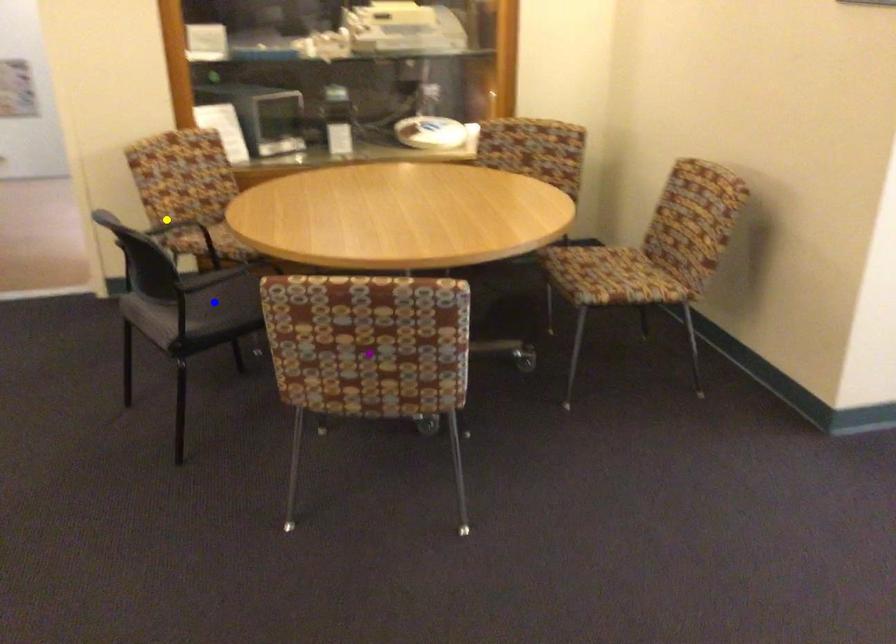
Order these from nearest to farthest:
- blue point
- yellow point
- purple point

purple point
blue point
yellow point